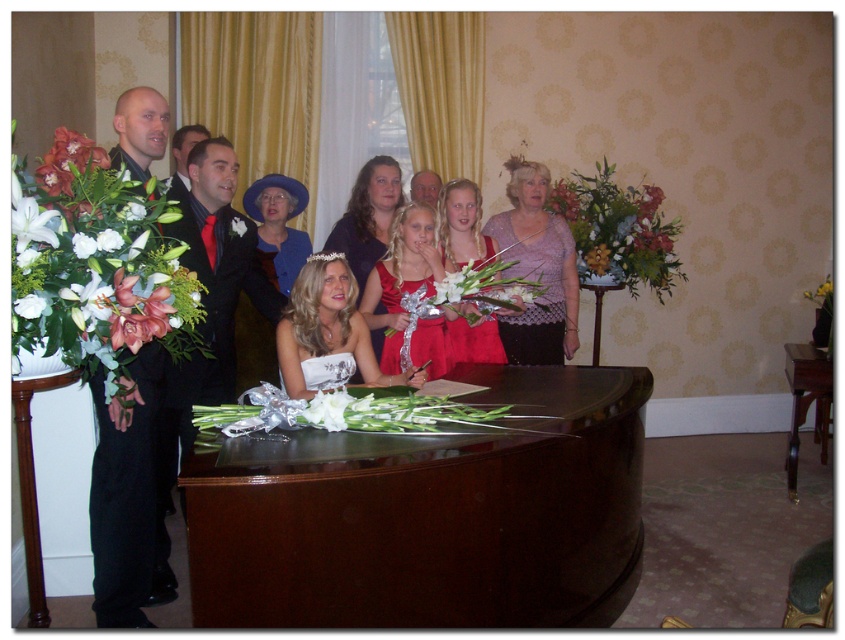
Does matte silver tiara at center appear on the left side of shiny black suit at center?

In fact, matte silver tiara at center is to the right of shiny black suit at center.

Who is higher up, matte silver tiara at center or shiny black suit at center?

shiny black suit at center

The width and height of the screenshot is (845, 640). Identify the location of matte silver tiara at center. (328, 328).

I want to click on matte silver tiara at center, so click(328, 328).

In the scene shown: Is lace fabric dress at center above white silk flower at center?

Yes, lace fabric dress at center is above white silk flower at center.

From the picture: Is lace fabric dress at center smaller than white silk flower at center?

Actually, lace fabric dress at center might be larger than white silk flower at center.

Image resolution: width=845 pixels, height=640 pixels. Identify the location of lace fabric dress at center. (537, 268).

Identify the location of lace fabric dress at center. (537, 268).

Is matte black dress at center to the left of matte silver tiara at center from the viewer's perspective?

Incorrect, matte black dress at center is not on the left side of matte silver tiara at center.

Is matte black dress at center positioned at the back of matte silver tiara at center?

That is True.

Which is in front, point (156, 593) or point (287, 342)?

Positioned in front is point (287, 342).

Identify the location of matte black dress at center. pos(554,298).